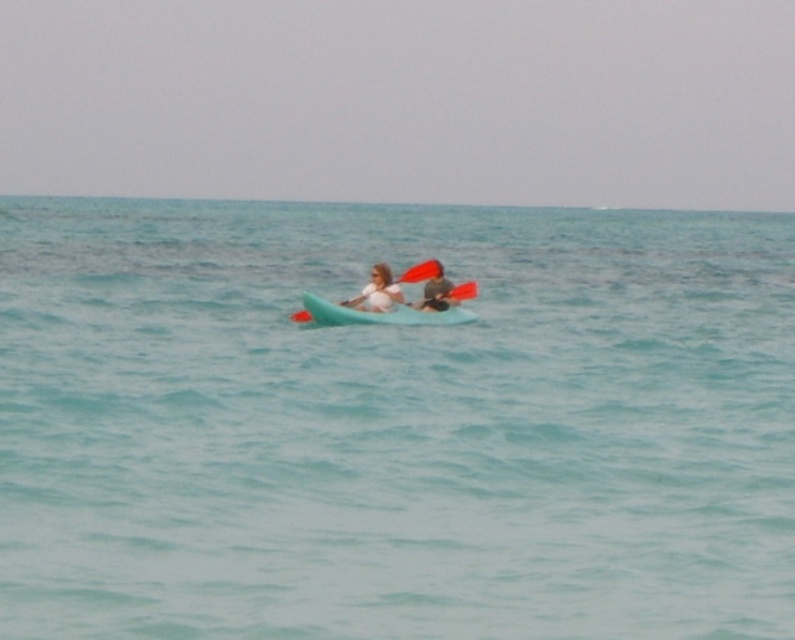
Question: Does matte green kayak at center appear on the left side of rubber paddle at center?

Choices:
 (A) yes
 (B) no

Answer: (B)

Question: Is teal rubber kayak at center above rubber paddle at center?

Choices:
 (A) yes
 (B) no

Answer: (B)

Question: Which object is positioned farthest from the matte green kayak at center?

Choices:
 (A) teal rubber kayak at center
 (B) rubber paddle at center
 (C) clear blue water at center

Answer: (C)

Question: Which of the following is the farthest from the observer?

Choices:
 (A) (386, 300)
 (B) (167, 317)
 (C) (429, 307)
 (D) (437, 266)

Answer: (B)

Question: Which of these objects is positioned closest to the matte green kayak at center?

Choices:
 (A) teal rubber kayak at center
 (B) rubber paddle at center
 (C) clear blue water at center
 (D) matte white bikini top at center

Answer: (B)

Question: Can you confirm if clear blue water at center is positioned above rubber paddle at center?

Choices:
 (A) yes
 (B) no

Answer: (A)